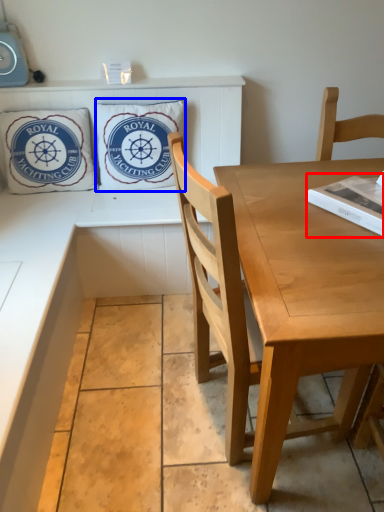
Question: Among these objects, which one is farthest to the camera, magazine (highlighted by a red box) or pillow (highlighted by a blue box)?

Choices:
 (A) magazine
 (B) pillow

Answer: (B)